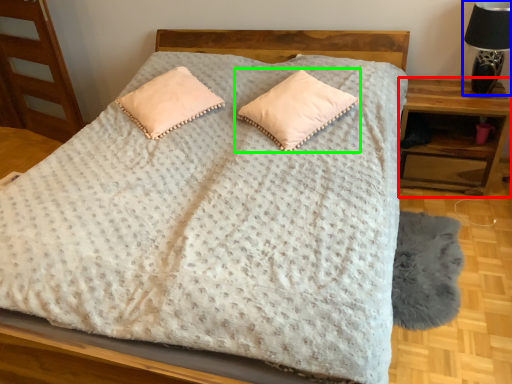
Question: Which object is the farthest from nightstand (highlighted by a red box)? Choose among these: table lamp (highlighted by a blue box) or pillow (highlighted by a green box).

Choices:
 (A) table lamp
 (B) pillow

Answer: (B)